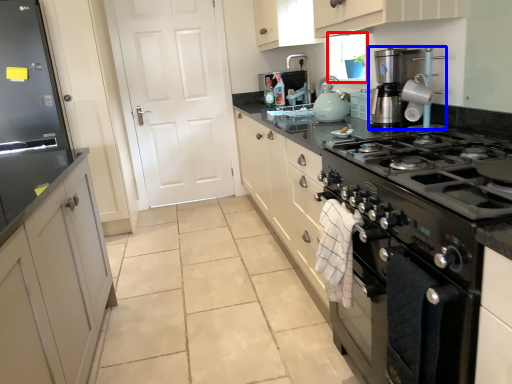
Question: Which object appears farthest to the camera in this image, window screen (highlighted by a red box) or home appliance (highlighted by a blue box)?

Choices:
 (A) window screen
 (B) home appliance

Answer: (A)